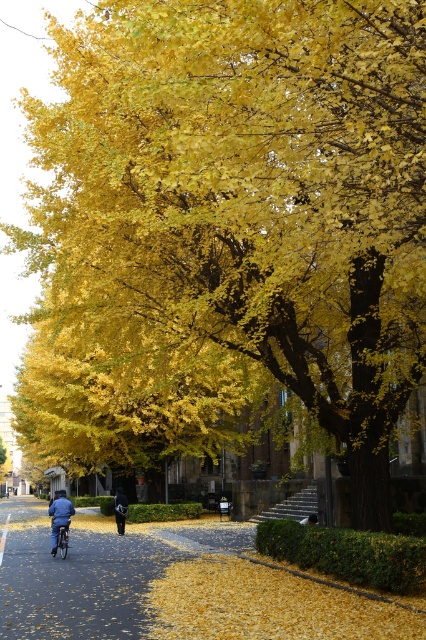
You are a pedestrian walking on the pathway and see the metallic silver bicycle at center and the dark blue fabric jacket at center. Which object is closer to your right side?

The metallic silver bicycle at center is closer to your right side because it is positioned to the right of the dark blue fabric jacket at center.

You are a pedestrian walking on the path and see the metallic silver bicycle at center and the dark blue fabric jacket at center. Which object is closer to you?

The metallic silver bicycle at center is closer to you because it is in front of the dark blue fabric jacket at center.